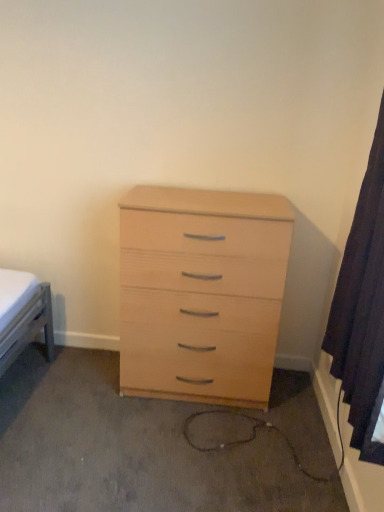
Question: In terms of width, does dark fabric curtain at right look wider or thinner when compared to light wood chest of drawers at center?

Choices:
 (A) thin
 (B) wide

Answer: (A)

Question: Is dark fabric curtain at right situated inside light wood chest of drawers at center or outside?

Choices:
 (A) outside
 (B) inside

Answer: (A)

Question: Looking at the image, does dark fabric curtain at right seem bigger or smaller compared to light wood chest of drawers at center?

Choices:
 (A) big
 (B) small

Answer: (B)

Question: Is light wood chest of drawers at center wider or thinner than dark fabric curtain at right?

Choices:
 (A) thin
 (B) wide

Answer: (B)

Question: From their relative heights in the image, would you say light wood chest of drawers at center is taller or shorter than dark fabric curtain at right?

Choices:
 (A) tall
 (B) short

Answer: (B)

Question: Is light wood chest of drawers at center inside or outside of dark fabric curtain at right?

Choices:
 (A) outside
 (B) inside

Answer: (A)

Question: From the image's perspective, relative to dark fabric curtain at right, is light wood chest of drawers at center above or below?

Choices:
 (A) below
 (B) above

Answer: (A)